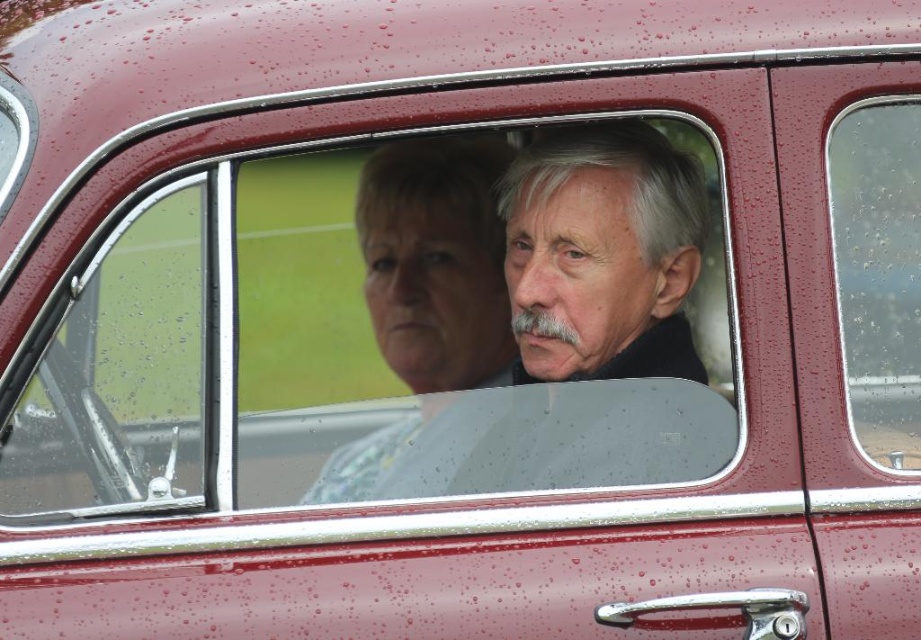
Question: Which point is farther from the camera taking this photo?

Choices:
 (A) (446, 333)
 (B) (621, 483)

Answer: (A)

Question: Does smooth gray hair at center have a larger size compared to smooth gray jacket at center?

Choices:
 (A) yes
 (B) no

Answer: (A)

Question: Where is smooth gray jacket at center located in relation to transparent glass window at right in the image?

Choices:
 (A) below
 (B) above

Answer: (A)

Question: Does smooth gray hair at center have a smaller size compared to smooth gray jacket at center?

Choices:
 (A) no
 (B) yes

Answer: (A)

Question: Which of these objects is positioned closest to the smooth gray jacket at center?

Choices:
 (A) smooth gray hair at center
 (B) transparent glass window at right

Answer: (A)

Question: Which of the following is the farthest from the observer?

Choices:
 (A) (625, 392)
 (B) (846, 250)

Answer: (A)